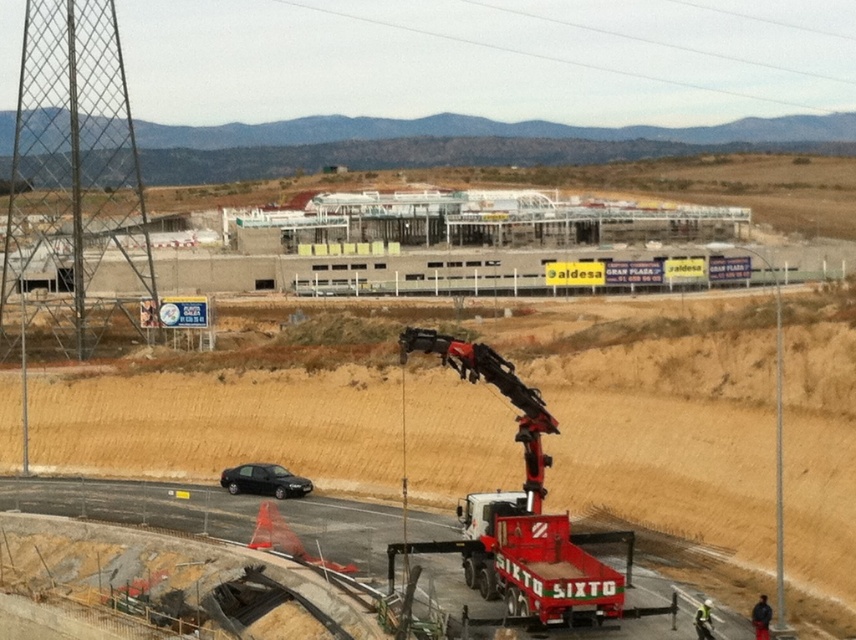
You are a construction worker standing at the entrance of the construction site. You need to locate the white concrete building at center. Based on the coordinates provided, where should you look relative to your position?

The white concrete building at center is located at coordinates point (518, 372), so you should look towards the center of the image to find it.